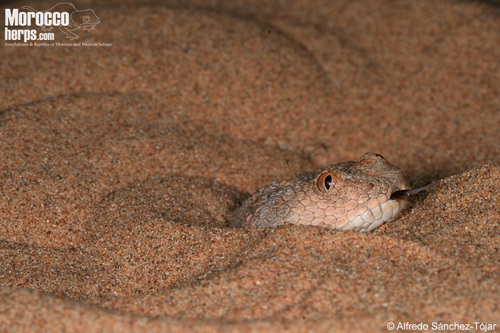
Identify the location of scales. (332, 211).